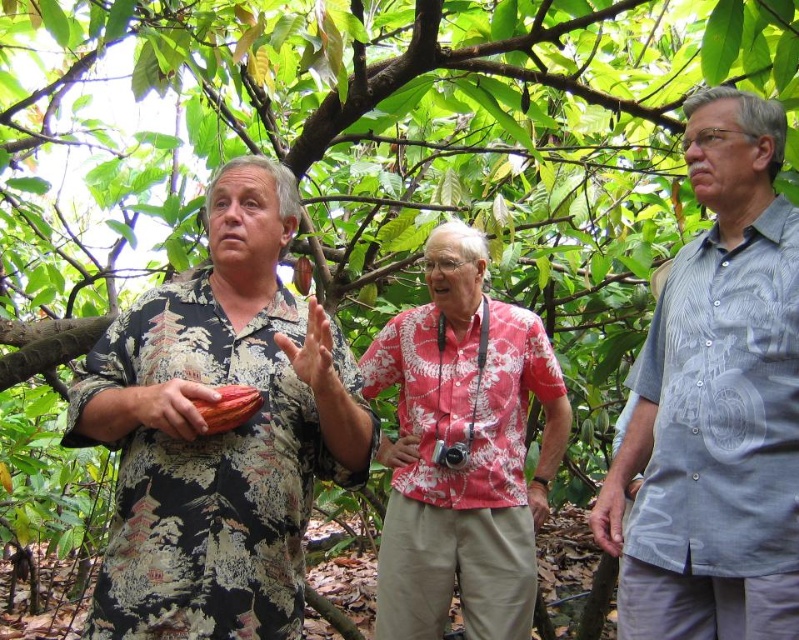
Question: Which is nearer to the brown floral shirt at center?

Choices:
 (A) red floral shirt at center
 (B) light blue printed shirt at right

Answer: (B)

Question: Which object is the closest to the brown floral shirt at center?

Choices:
 (A) light blue printed shirt at right
 (B) red floral shirt at center

Answer: (A)

Question: Is brown floral shirt at center wider than red floral shirt at center?

Choices:
 (A) no
 (B) yes

Answer: (A)

Question: Which of the following is the closest to the observer?

Choices:
 (A) brown floral shirt at center
 (B) light blue printed shirt at right

Answer: (A)

Question: Is light blue printed shirt at right smaller than red floral shirt at center?

Choices:
 (A) yes
 (B) no

Answer: (A)

Question: Considering the relative positions of brown floral shirt at center and red floral shirt at center in the image provided, where is brown floral shirt at center located with respect to red floral shirt at center?

Choices:
 (A) below
 (B) above

Answer: (B)